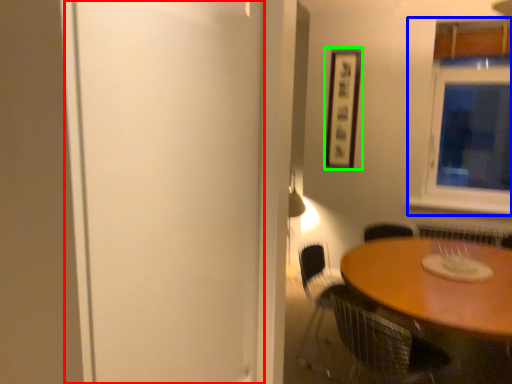
Question: Which object is positioned closest to screen door (highlighted by a red box)? Select from window (highlighted by a blue box) and picture frame (highlighted by a green box).

Choices:
 (A) window
 (B) picture frame

Answer: (B)